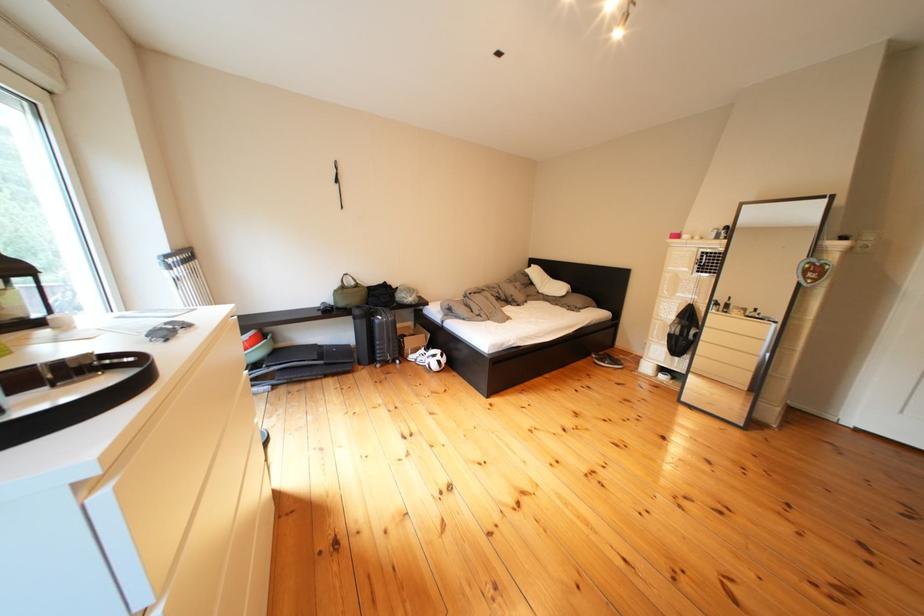
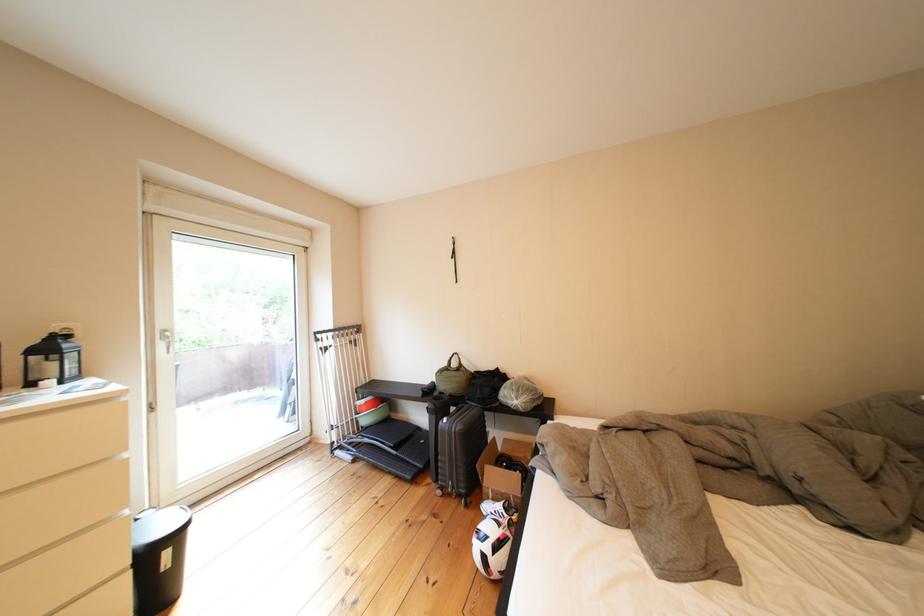
Locate, in the second image, the point that corresponds to point (423, 347) in the first image.

(505, 480)